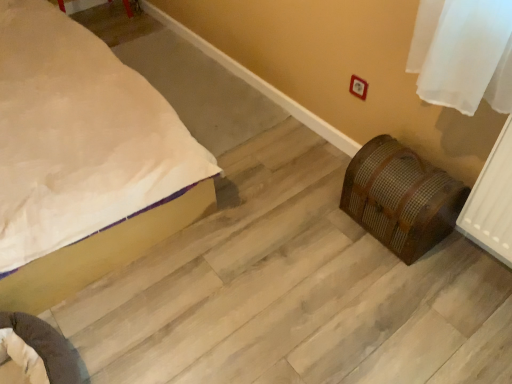
What do you see at coordinates (401, 197) in the screenshot? Image resolution: width=512 pixels, height=384 pixels. I see `brown woven chest at lower right` at bounding box center [401, 197].

What is the approximate width of brown woven chest at lower right?

9.59 inches.

What are the coordinates of `brown woven chest at lower right` in the screenshot? It's located at (401, 197).

This screenshot has height=384, width=512. What do you see at coordinates (101, 253) in the screenshot?
I see `white matte bed at lower left` at bounding box center [101, 253].

Find the location of a particular element. The height and width of the screenshot is (384, 512). white matte bed at lower left is located at coordinates (101, 253).

In order to face white matte bed at lower left, should I rotate leftwards or rightwards?

Rotate your view left by about 30.880°.

The image size is (512, 384). Find the location of `brown woven chest at lower right`. brown woven chest at lower right is located at coordinates coord(401,197).

Between brown woven chest at lower right and white matte bed at lower left, which one appears on the right side from the viewer's perspective?

brown woven chest at lower right.

Does brown woven chest at lower right come behind white matte bed at lower left?

Yes, brown woven chest at lower right is further from the viewer.

Which is less distant, (422, 180) or (46, 278)?

Point (422, 180) is positioned farther from the camera compared to point (46, 278).

From the image's perspective, would you say brown woven chest at lower right is positioned over white matte bed at lower left?

No, from the image's perspective, brown woven chest at lower right is not above white matte bed at lower left.

From a real-world perspective, which object stands above the other?

In real-world perspective, white matte bed at lower left is above.

Is brown woven chest at lower right wider or thinner than white matte bed at lower left?

Considering their sizes, brown woven chest at lower right looks slimmer than white matte bed at lower left.

Considering the sizes of objects brown woven chest at lower right and white matte bed at lower left in the image provided, who is taller, brown woven chest at lower right or white matte bed at lower left?

white matte bed at lower left.

Looking at the image, does brown woven chest at lower right seem bigger or smaller compared to white matte bed at lower left?

brown woven chest at lower right is smaller than white matte bed at lower left.

Do you think brown woven chest at lower right is within white matte bed at lower left, or outside of it?

brown woven chest at lower right is not enclosed by white matte bed at lower left.

Is brown woven chest at lower right not close to white matte bed at lower left?

Actually, brown woven chest at lower right and white matte bed at lower left are a little close together.

Consider the image. Is brown woven chest at lower right turned away from white matte bed at lower left?

No, brown woven chest at lower right is not facing away from white matte bed at lower left.

This screenshot has width=512, height=384. I want to click on furniture below the white matte bed at lower left (from a real-world perspective), so click(401, 197).

Between white matte bed at lower left and brown woven chest at lower right, which one appears on the right side from the viewer's perspective?

From the viewer's perspective, brown woven chest at lower right appears more on the right side.

Which object is further away from the camera taking this photo, white matte bed at lower left or brown woven chest at lower right?

brown woven chest at lower right is more distant.

Looking at this image, which point is more distant from viewer, (100,258) or (459,208)?

The point (100,258) is farther.

From the image's perspective, is white matte bed at lower left above brown woven chest at lower right?

Yes, from the image's perspective, white matte bed at lower left is over brown woven chest at lower right.

From a real-world perspective, who is located lower, white matte bed at lower left or brown woven chest at lower right?

From a 3D spatial view, brown woven chest at lower right is below.

Considering the relative sizes of white matte bed at lower left and brown woven chest at lower right in the image provided, is white matte bed at lower left thinner than brown woven chest at lower right?

No.

Between white matte bed at lower left and brown woven chest at lower right, which one has less height?

brown woven chest at lower right is shorter.

Can you confirm if white matte bed at lower left is bigger than brown woven chest at lower right?

Yes, white matte bed at lower left is bigger than brown woven chest at lower right.

Is brown woven chest at lower right surrounded by white matte bed at lower left?

No, brown woven chest at lower right is not surrounded by white matte bed at lower left.

Does white matte bed at lower left touch brown woven chest at lower right?

No, white matte bed at lower left is not beside brown woven chest at lower right.

In the scene shown: Is white matte bed at lower left oriented away from brown woven chest at lower right?

No, white matte bed at lower left is not facing the opposite direction of brown woven chest at lower right.

How many degrees apart are the facing directions of white matte bed at lower left and brown woven chest at lower right?

The angular difference between white matte bed at lower left and brown woven chest at lower right is 89.9 degrees.

Where is `bed on the left side of brown woven chest at lower right`? The width and height of the screenshot is (512, 384). bed on the left side of brown woven chest at lower right is located at coordinates (101, 253).

Identify the location of furniture behind the white matte bed at lower left. This screenshot has height=384, width=512. (401, 197).

Where is `bed on the left of the brown woven chest at lower right`? The image size is (512, 384). bed on the left of the brown woven chest at lower right is located at coordinates (101, 253).